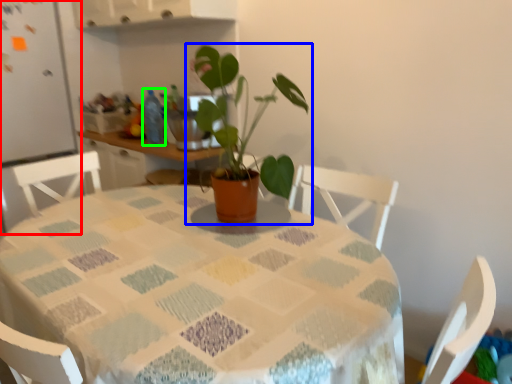
Question: Which object is positioned farthest from fridge (highlighted by a red box)? Select from houseplant (highlighted by a blue box) and bottle (highlighted by a green box).

Choices:
 (A) houseplant
 (B) bottle

Answer: (A)